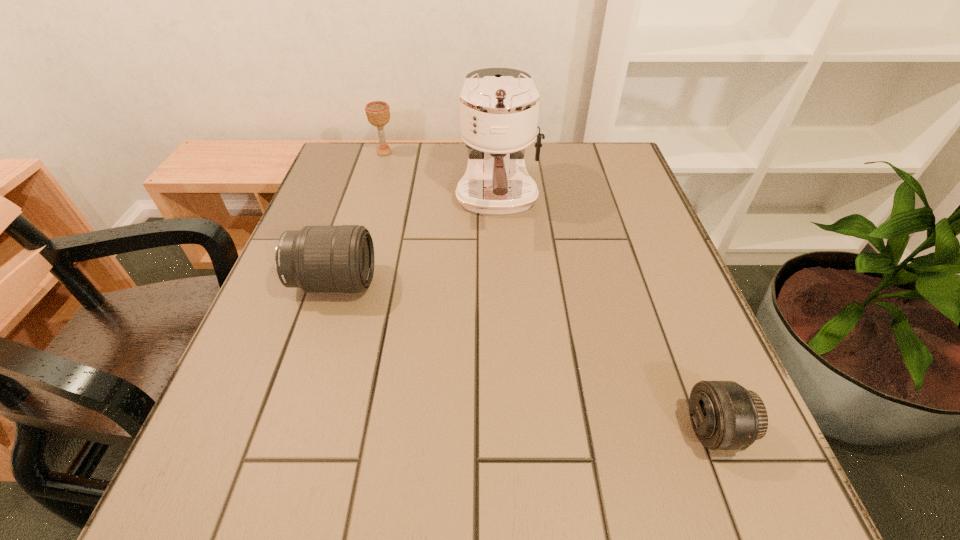
This screenshot has height=540, width=960. Identify the location of vacant space located 0.100m on the front-facing side of the shortest object. (622, 430).

The width and height of the screenshot is (960, 540). In order to click on free space located 0.270m on the front-facing side of the shortest object in this screenshot , I will do `click(512, 430)`.

Image resolution: width=960 pixels, height=540 pixels. Find the location of `vacant space located on the front-facing side of the shortest object`. vacant space located on the front-facing side of the shortest object is located at coordinates (518, 430).

I want to click on coffee maker that is at the far edge, so coord(499,107).

Where is `chalice that is at the far edge`? chalice that is at the far edge is located at coordinates (378, 112).

Identify the location of chalice present at the left edge. Image resolution: width=960 pixels, height=540 pixels. [378, 112].

You are a GUI agent. You are given a task and a screenshot of the screen. Output one action in this format:
    pyautogui.click(x=<x>, y=<y>)
    Task: Click on the telephoto lens at the left edge
    The image size is (960, 540).
    Given the screenshot: What is the action you would take?
    pyautogui.click(x=316, y=258)

Find the location of a particular element. Image resolution: width=960 pixels, height=540 pixels. object that is at the right edge is located at coordinates (724, 415).

This screenshot has height=540, width=960. I want to click on object that is at the far left corner, so click(x=378, y=112).

In the image, there is a desktop. Where is `blank space at the far edge`? The image size is (960, 540). blank space at the far edge is located at coordinates (442, 189).